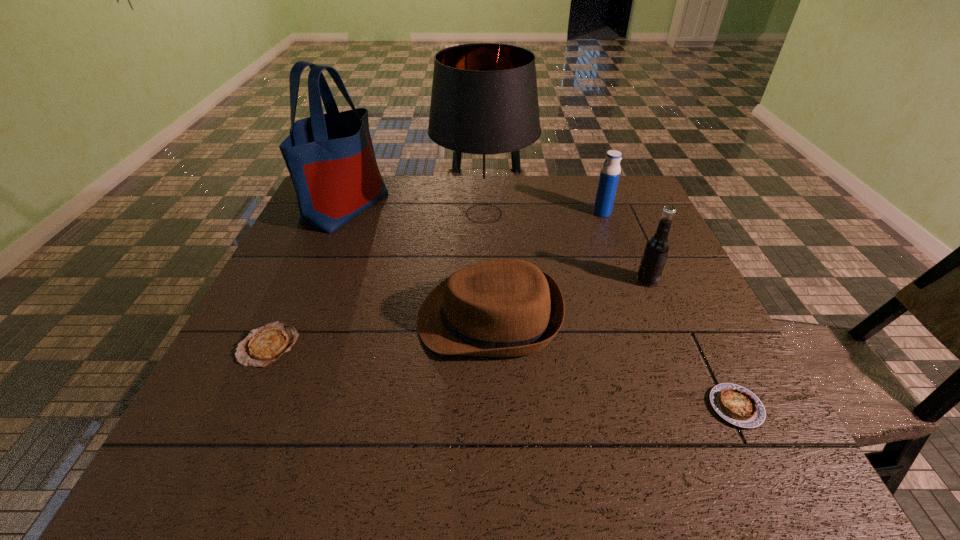
Find the location of `lampshade situated at the far edge`. lampshade situated at the far edge is located at coordinates (484, 110).

Where is `handbag located in the far edge section of the desktop`? Image resolution: width=960 pixels, height=540 pixels. handbag located in the far edge section of the desktop is located at coordinates (330, 157).

Identify the location of water bottle at the far edge. (610, 171).

You are a GUI agent. You are given a task and a screenshot of the screen. Output one action in this format:
    pyautogui.click(x=<x>, y=<y>)
    Task: Click on the handbag present at the left edge
    This screenshot has height=540, width=960.
    Given the screenshot: What is the action you would take?
    pyautogui.click(x=330, y=157)

The height and width of the screenshot is (540, 960). In order to click on quiche positioned at the left edge in this screenshot , I will do `click(264, 345)`.

Image resolution: width=960 pixels, height=540 pixels. In order to click on root beer that is at the right edge in this screenshot , I will do `click(657, 248)`.

Find the location of a particular element. The width and height of the screenshot is (960, 540). water bottle that is positioned at the right edge is located at coordinates (610, 171).

At what (x,y) coordinates should I click in order to perform the action: click on quiche present at the right edge. Please return your answer as a coordinate pair (x, y). This screenshot has height=540, width=960. Looking at the image, I should click on (737, 405).

Locate an element on the screen. object positioned at the far left corner is located at coordinates (330, 157).

You are a GUI agent. You are given a task and a screenshot of the screen. Output one action in this format:
    pyautogui.click(x=<x>, y=<y>)
    Task: Click on the object that is at the far right corner
    The image size is (960, 540).
    Given the screenshot: What is the action you would take?
    pyautogui.click(x=610, y=171)